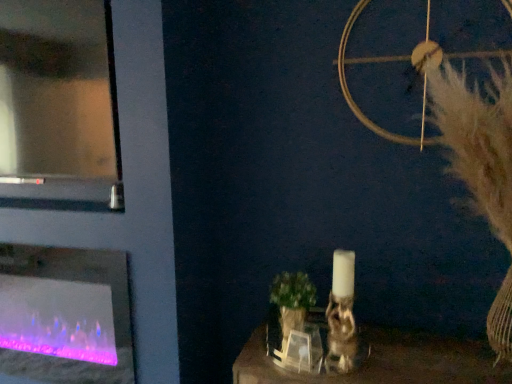
The image size is (512, 384). In order to click on free area below white fluffy feather at upper right (from a real-world perspective) in this screenshot , I will do `click(461, 358)`.